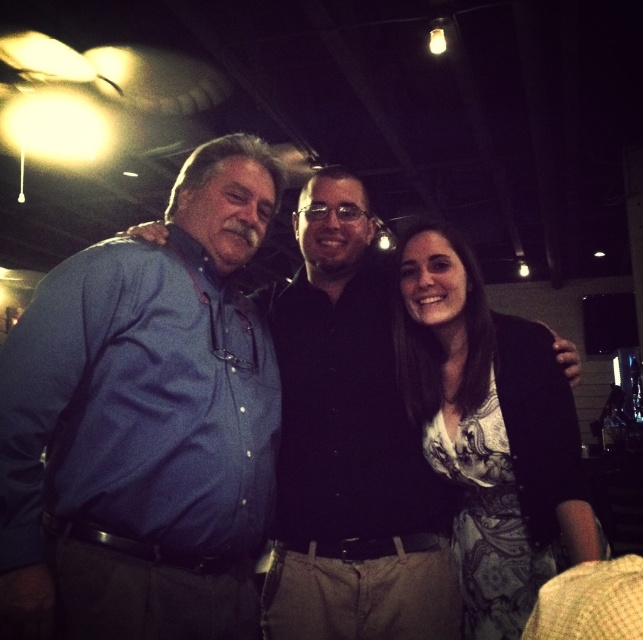
Is point (116, 301) farther from viewer compared to point (527, 467)?

No, (116, 301) is in front of (527, 467).

You are a GUI agent. You are given a task and a screenshot of the screen. Output one action in this format:
    pyautogui.click(x=<x>, y=<y>)
    Task: Click on the blue cotton shirt at left
    
    Given the screenshot: What is the action you would take?
    pyautogui.click(x=145, y=422)

Which is behind, point (188, 452) or point (449, 365)?

The point (449, 365) is more distant.

Measure the distance between matte blue shirt at center and camera.

matte blue shirt at center and camera are 38.47 inches apart.

The height and width of the screenshot is (640, 643). Find the location of `matte blue shirt at center`. matte blue shirt at center is located at coordinates (145, 424).

Is blue cotton shirt at left above matte blue shirt at center?

Actually, blue cotton shirt at left is below matte blue shirt at center.

Does blue cotton shirt at left have a lesser height compared to matte blue shirt at center?

Correct, blue cotton shirt at left is not as tall as matte blue shirt at center.

Which is in front, point (105, 520) or point (114, 433)?

Positioned in front is point (105, 520).

This screenshot has height=640, width=643. I want to click on blue cotton shirt at left, so click(x=145, y=422).